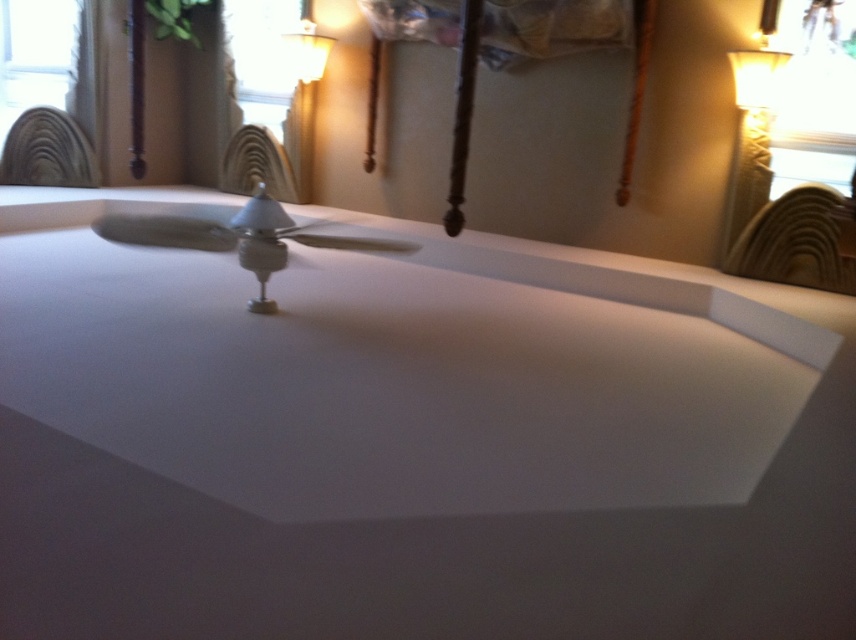
Question: Does white ceramic lampshade at upper right appear on the right side of matte white lampshade at upper center?

Choices:
 (A) no
 (B) yes

Answer: (B)

Question: Considering the real-world distances, which object is closest to the white glossy table at center?

Choices:
 (A) white ceramic lampshade at upper right
 (B) matte white lampshade at upper center

Answer: (A)

Question: Does white glossy table at center have a greater width compared to white ceramic lampshade at upper right?

Choices:
 (A) no
 (B) yes

Answer: (B)

Question: Does white ceramic lampshade at upper right appear over matte white lampshade at upper center?

Choices:
 (A) no
 (B) yes

Answer: (A)

Question: Which object is positioned closest to the white glossy table at center?

Choices:
 (A) white ceramic lampshade at upper right
 (B) matte white lampshade at upper center

Answer: (A)

Question: Which point is closer to the camera?

Choices:
 (A) white ceramic lampshade at upper right
 (B) matte white lampshade at upper center

Answer: (A)